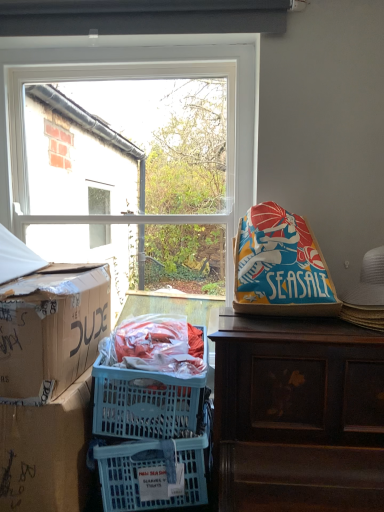
Question: Is brown wooden desk at upper right in front of or behind cardboard box at left, acting as the 2th box starting from the bottom, in the image?

Choices:
 (A) front
 (B) behind

Answer: (A)

Question: Visually, is brown wooden desk at upper right positioned to the left or to the right of cardboard box at left, positioned as the 1th box in top-to-bottom order?

Choices:
 (A) left
 (B) right

Answer: (B)

Question: Estimate the real-world distances between objects in this image. Which object is farther from the clear glass window at upper center?

Choices:
 (A) blue fabric bean bag at right
 (B) cardboard box at left, arranged as the 1th box when ordered from the bottom
 (C) brown wooden desk at upper right
 (D) cardboard box at left, acting as the 2th box starting from the bottom

Answer: (B)

Question: Estimate the real-world distances between objects in this image. Which object is farther from the clear glass window at upper center?

Choices:
 (A) cardboard box at left, acting as the 2th box starting from the top
 (B) cardboard box at left, positioned as the 1th box in top-to-bottom order
 (C) blue fabric bean bag at right
 (D) brown wooden desk at upper right

Answer: (A)